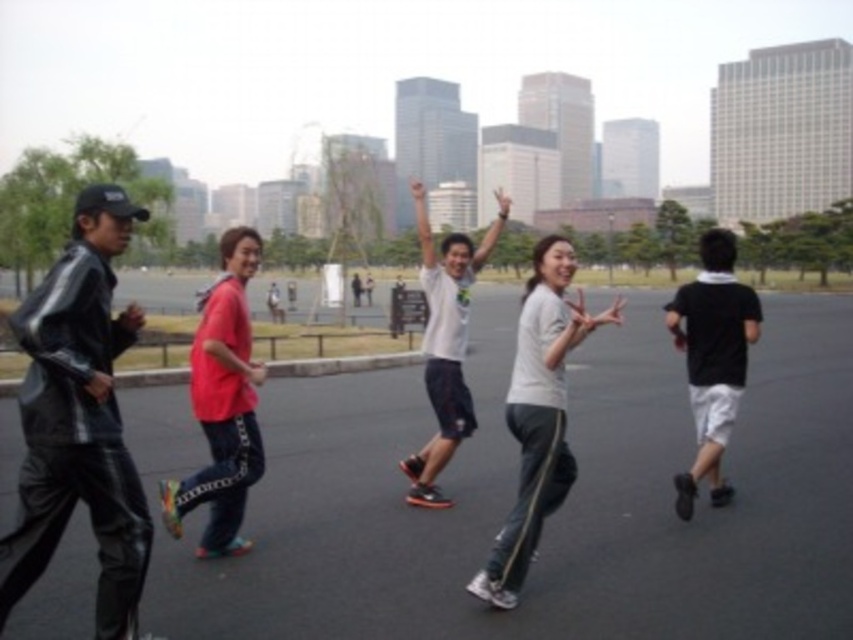
Is point (549, 376) farther from viewer compared to point (410, 467)?

No, (549, 376) is closer to viewer.

Does white matte pants at center appear over white matte shirt at center?

No.

Measure the distance between white matte pants at center and camera.

white matte pants at center and camera are 3.92 meters apart from each other.

In order to click on white matte pants at center in this screenshot , I will do `click(538, 413)`.

Does red matte skateboard at center have a larger size compared to black matte shorts at right?

Yes.

Between red matte skateboard at center and black matte shorts at right, which one is positioned lower?

black matte shorts at right

Is point (248, 264) positioned behind point (688, 502)?

No, (248, 264) is in front of (688, 502).

Where is `red matte skateboard at center`? This screenshot has height=640, width=853. red matte skateboard at center is located at coordinates (222, 404).

Between point (579, 305) and point (669, 326), which one is positioned in front?

Point (579, 305)

Does point (521, 483) come in front of point (704, 440)?

Yes, it is in front of point (704, 440).

This screenshot has height=640, width=853. What are the coordinates of `white matte pants at center` in the screenshot? It's located at point(538,413).